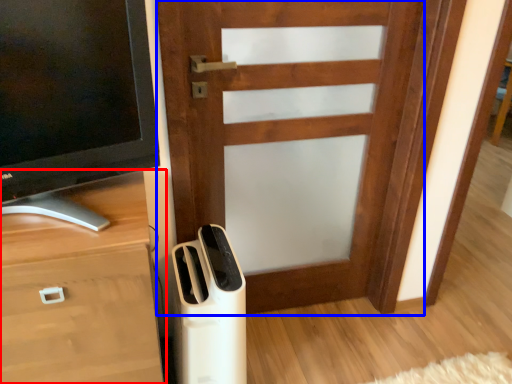
Question: Which object is closer to the camera taking this photo, chest of drawers (highlighted by a red box) or door (highlighted by a blue box)?

Choices:
 (A) chest of drawers
 (B) door

Answer: (A)